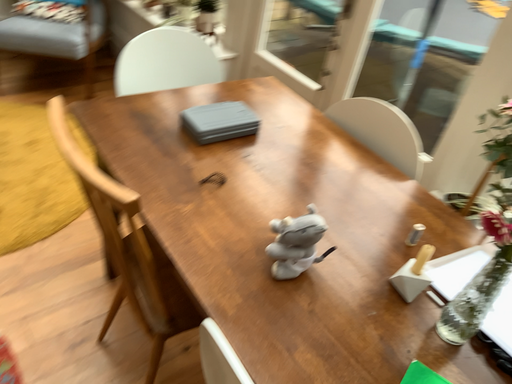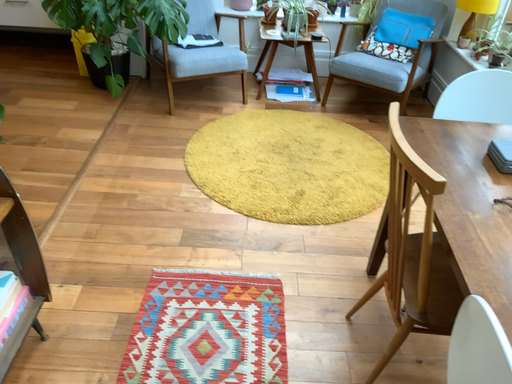
Question: Which way did the camera rotate in the video?

Choices:
 (A) rotated right
 (B) rotated left

Answer: (B)